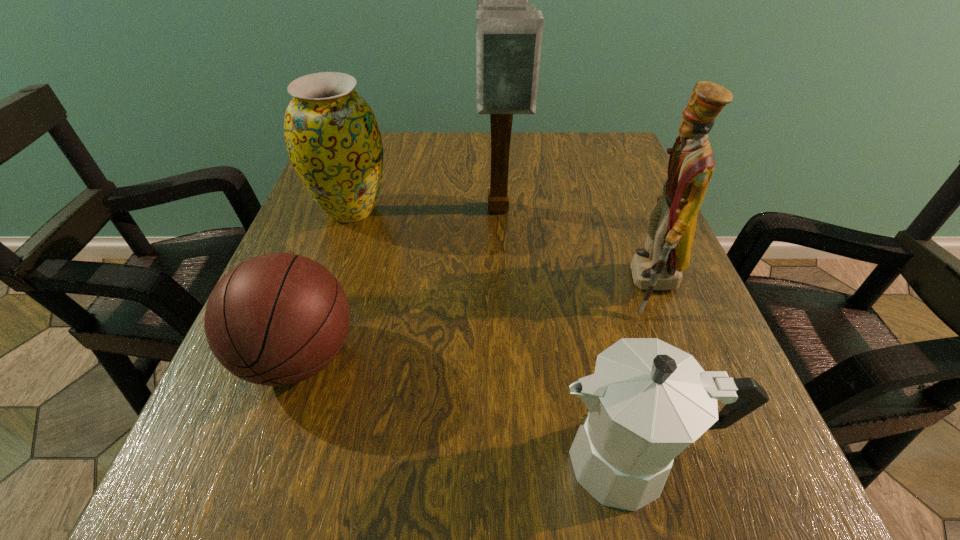
Where is `vacant space located 0.350m on the right of the vase`? Image resolution: width=960 pixels, height=540 pixels. vacant space located 0.350m on the right of the vase is located at coordinates (559, 210).

I want to click on free region located 0.290m at the spout of the second shortest object, so click(x=321, y=461).

At what (x,y) coordinates should I click in order to perform the action: click on free spot located at the spout of the second shortest object. Please return your answer as a coordinate pair (x, y). This screenshot has width=960, height=540. Looking at the image, I should click on (304, 461).

Image resolution: width=960 pixels, height=540 pixels. Find the location of `vacant space located at the spout of the second shortest object`. vacant space located at the spout of the second shortest object is located at coordinates tap(480, 461).

Identify the location of vacant area located on the right of the shortest object. (472, 357).

This screenshot has width=960, height=540. Identify the location of object that is at the far edge. (509, 31).

Locate an element on the screen. Image resolution: width=960 pixels, height=540 pixels. object that is positioned at the near edge is located at coordinates (648, 400).

The image size is (960, 540). I want to click on vase positioned at the left edge, so click(333, 140).

Locate an element on the screen. basketball that is at the left edge is located at coordinates (276, 319).

Identify the location of nutcracker positioned at the right edge. (658, 266).